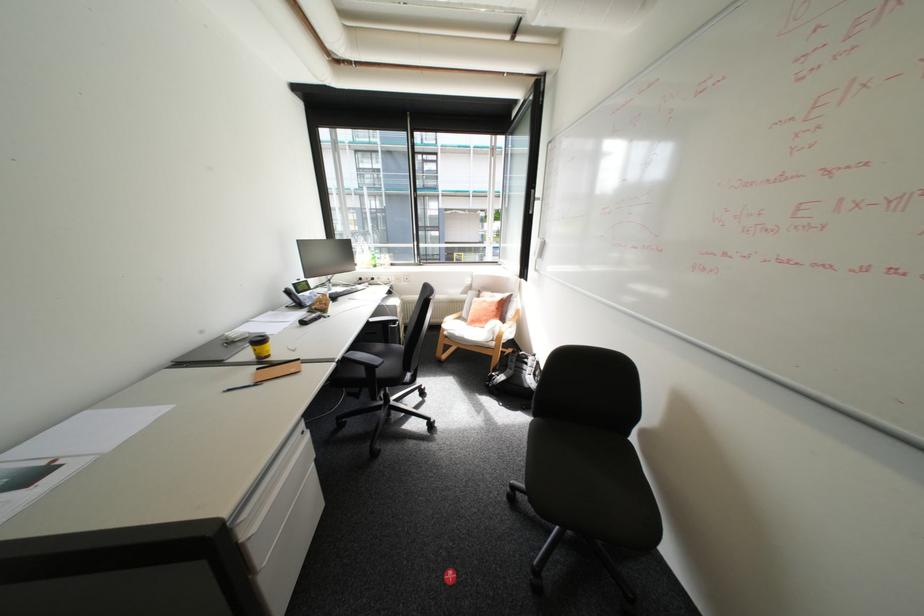
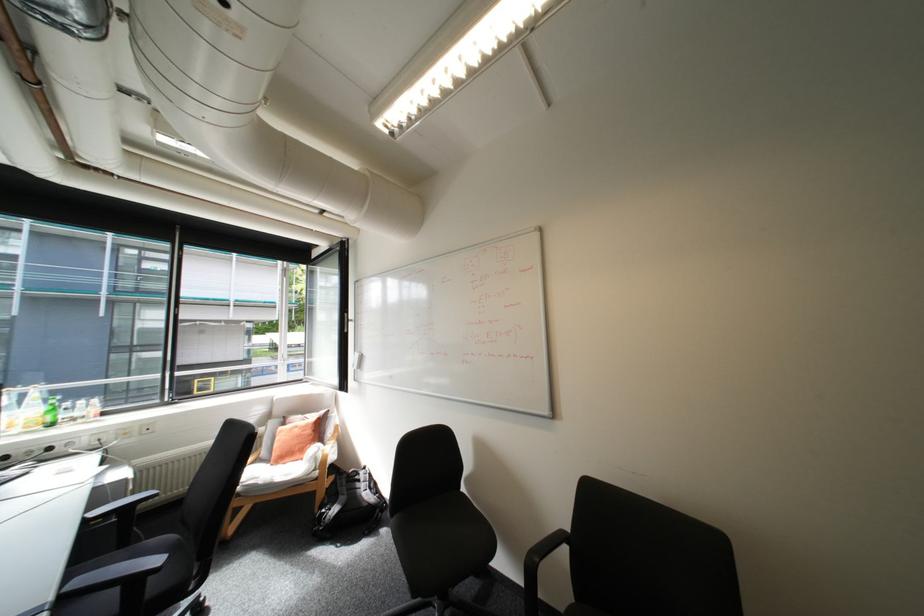
Locate, in the second image, the point that corresponds to the point at 494,302 in the first image.

(307, 429)